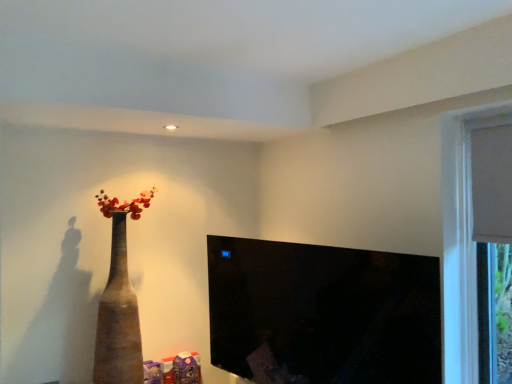
Question: From a real-world perspective, is black glossy tv at center positioned under brown matte vase at left based on gravity?

Choices:
 (A) yes
 (B) no

Answer: (A)

Question: Does black glossy tv at center have a larger size compared to brown matte vase at left?

Choices:
 (A) yes
 (B) no

Answer: (B)

Question: Is black glossy tv at center further to the viewer compared to brown matte vase at left?

Choices:
 (A) no
 (B) yes

Answer: (A)

Question: Does black glossy tv at center lie in front of brown matte vase at left?

Choices:
 (A) yes
 (B) no

Answer: (A)

Question: Are black glossy tv at center and brown matte vase at left located far from each other?

Choices:
 (A) no
 (B) yes

Answer: (B)

Question: Is black glossy tv at center to the right of brown matte vase at left from the viewer's perspective?

Choices:
 (A) no
 (B) yes

Answer: (B)

Question: From the image's perspective, would you say brown matte vase at left is positioned over black glossy tv at center?

Choices:
 (A) no
 (B) yes

Answer: (B)

Question: Can you confirm if brown matte vase at left is taller than black glossy tv at center?

Choices:
 (A) no
 (B) yes

Answer: (B)

Question: Considering the relative sizes of brown matte vase at left and black glossy tv at center in the image provided, is brown matte vase at left bigger than black glossy tv at center?

Choices:
 (A) no
 (B) yes

Answer: (B)

Question: Is the position of brown matte vase at left less distant than that of black glossy tv at center?

Choices:
 (A) yes
 (B) no

Answer: (B)

Question: Is brown matte vase at left positioned far away from black glossy tv at center?

Choices:
 (A) yes
 (B) no

Answer: (A)

Question: Is brown matte vase at left positioned behind black glossy tv at center?

Choices:
 (A) no
 (B) yes

Answer: (B)

Question: Is black glossy tv at center wider or thinner than brown matte vase at left?

Choices:
 (A) wide
 (B) thin

Answer: (B)